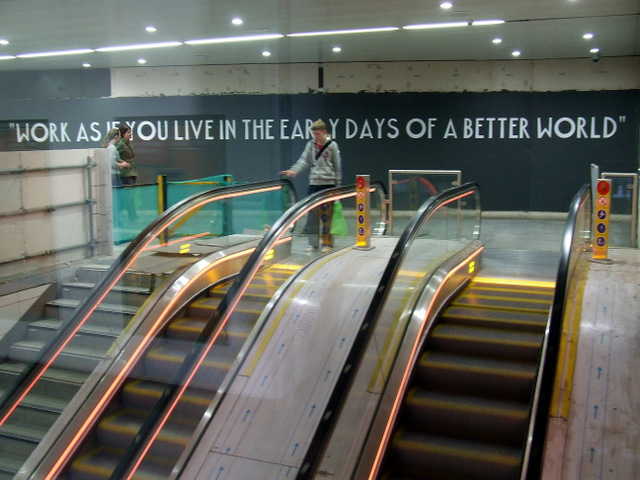
Identify the location of ceiling lights. Image resolution: width=640 pixels, height=480 pixels. (288, 33), (118, 49), (153, 30), (483, 20), (498, 39).